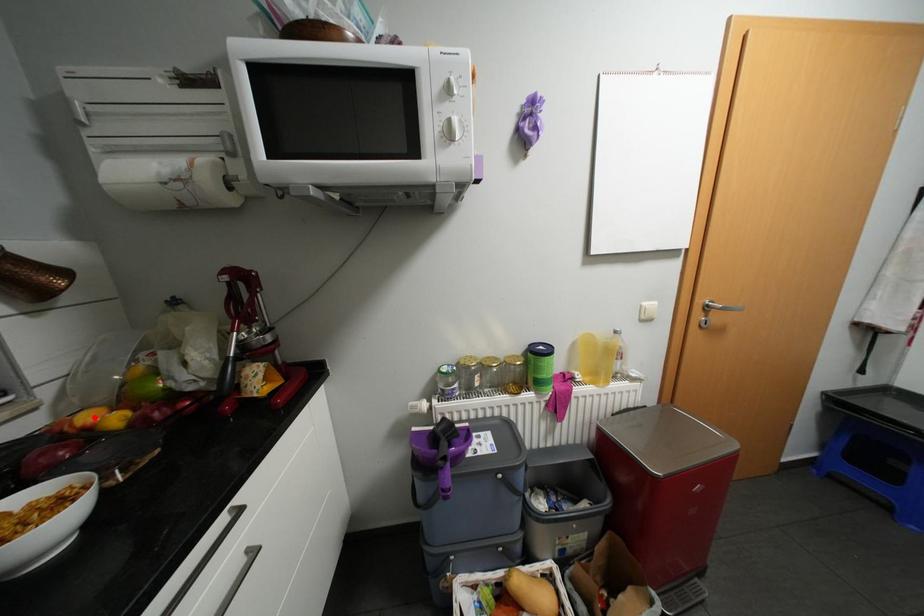
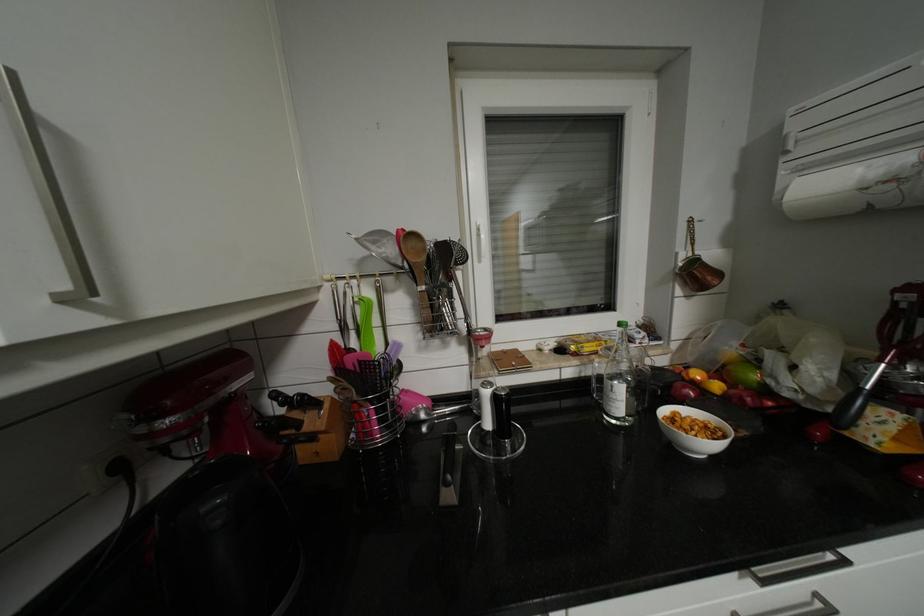
Find the pixel in the second image that matches the highlighted location in the first image.

(704, 374)